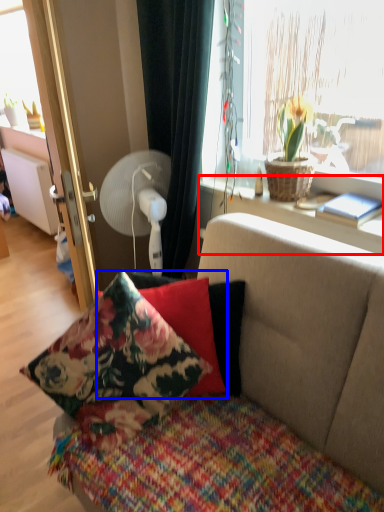
Question: Which object appears closest to the camera in this image, window sill (highlighted by a red box) or pillow (highlighted by a blue box)?

Choices:
 (A) window sill
 (B) pillow

Answer: (B)